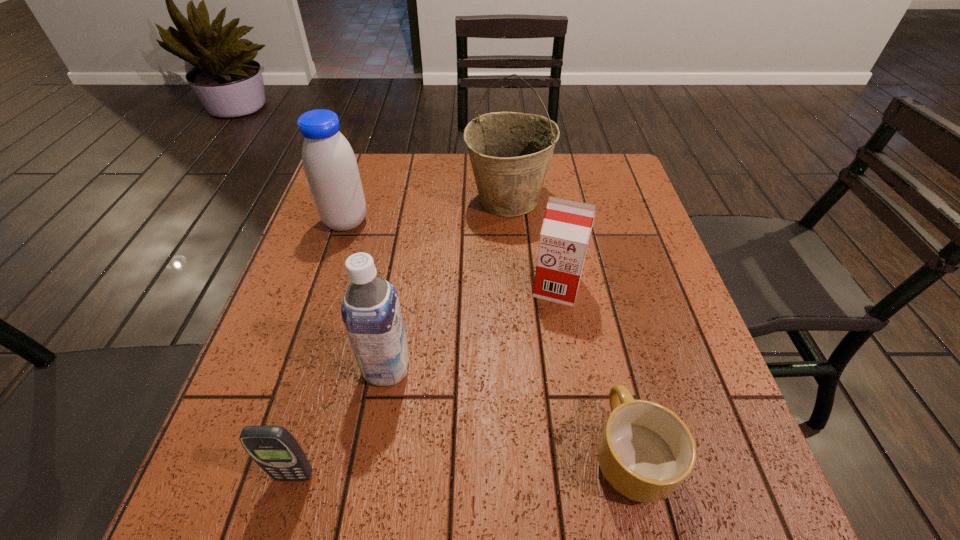
Find the location of `free space that is in between the wine bucket and the third nearest object`. free space that is in between the wine bucket and the third nearest object is located at coordinates (447, 284).

The height and width of the screenshot is (540, 960). Identify the location of free space between the cellular telephone and the fourth tallest object. (426, 382).

Identify the location of free space between the mug and the nearest soya milk. The height and width of the screenshot is (540, 960). (509, 410).

This screenshot has width=960, height=540. Find the location of `vacant space in between the third shortest object and the wine bucket`. vacant space in between the third shortest object and the wine bucket is located at coordinates (533, 244).

Where is `empty location between the mug and the leftmost soya milk`? empty location between the mug and the leftmost soya milk is located at coordinates (489, 338).

Select which object appears as the closest to the mug. Please provide its 2D coordinates. Your answer should be formatted as a tuple, i.e. [(x, y)], where the tuple contains the x and y coordinates of a point satisfying the conditions above.

[(567, 224)]

Locate an element on the screen. Image resolution: width=960 pixels, height=540 pixels. object that stands as the fourth closest to the wine bucket is located at coordinates (645, 452).

This screenshot has width=960, height=540. I want to click on soya milk that can be found as the second closest to the cellular telephone, so click(x=567, y=224).

The height and width of the screenshot is (540, 960). Find the location of `soya milk that is the closest to the leftmost soya milk`. soya milk that is the closest to the leftmost soya milk is located at coordinates (371, 313).

This screenshot has height=540, width=960. I want to click on vacant area that satisfies the following two spatial constraints: 1. on the side with the handle of the shortest object; 2. on the label of the fourth farthest object, so coord(611,368).